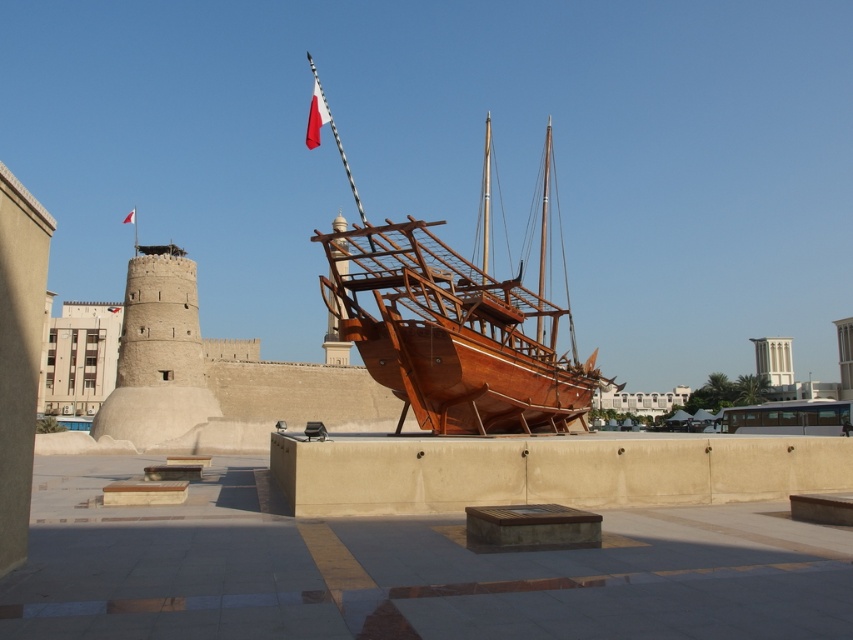
Who is positioned more to the left, white fabric flag at upper center or red fabric flag at upper center?

red fabric flag at upper center

Is white fabric flag at upper center to the left of red fabric flag at upper center from the viewer's perspective?

No, white fabric flag at upper center is not to the left of red fabric flag at upper center.

This screenshot has width=853, height=640. What do you see at coordinates (316, 116) in the screenshot?
I see `white fabric flag at upper center` at bounding box center [316, 116].

Locate an element on the screen. The width and height of the screenshot is (853, 640). white fabric flag at upper center is located at coordinates (316, 116).

Between wooden ship at center and white fabric flag at upper center, which one has less height?

white fabric flag at upper center is shorter.

Is point (376, 378) in front of point (312, 145)?

Yes, it is in front of point (312, 145).

Where is `wooden ship at center`? wooden ship at center is located at coordinates (453, 330).

Which is below, wooden ship at center or red fabric flag at upper center?

red fabric flag at upper center is below.

Does point (462, 330) come closer to viewer compared to point (131, 218)?

Yes.

The height and width of the screenshot is (640, 853). In order to click on wooden ship at center in this screenshot , I will do `click(453, 330)`.

Locate an element on the screen. This screenshot has height=640, width=853. wooden ship at center is located at coordinates (453, 330).